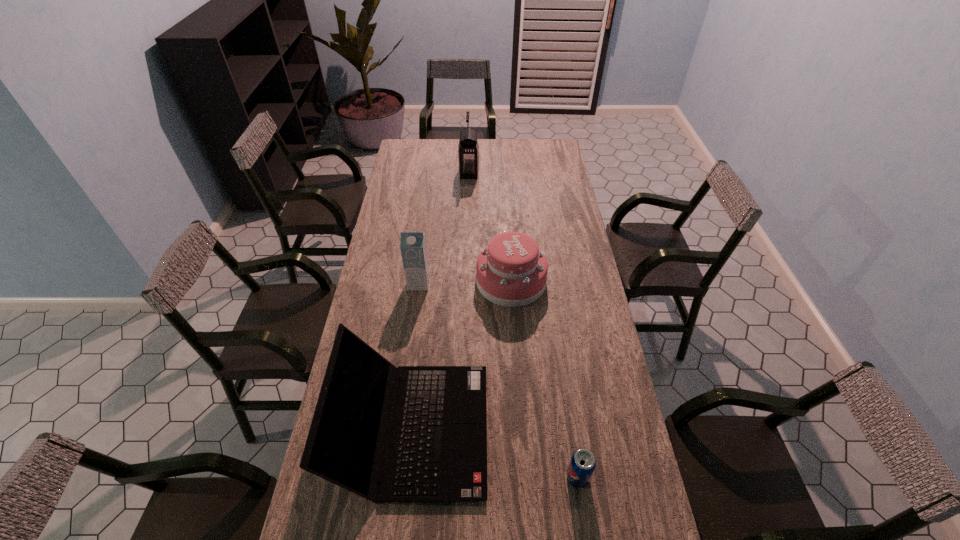
Where is `the tallest object`? The image size is (960, 540). the tallest object is located at coordinates (468, 148).

Image resolution: width=960 pixels, height=540 pixels. I want to click on the farthest object, so [x=468, y=148].

I want to click on carton, so click(413, 248).

Find the location of a particular element. The image size is (960, 540). laptop computer is located at coordinates (438, 453).

Find the location of a particular element. The height and width of the screenshot is (540, 960). cake is located at coordinates (511, 271).

You are a GUI agent. You are given a task and a screenshot of the screen. Output one action in this format:
    pyautogui.click(x=<x>, y=<y>)
    Task: Click on the pop soda
    The height and width of the screenshot is (540, 960).
    Given the screenshot: What is the action you would take?
    (x=582, y=464)

Find the location of a particular element. Image resolution: width=960 pixels, height=540 pixels. vacant space situated 0.380m on the front-facing side of the tallest object is located at coordinates (552, 173).

In order to click on vacant position located on the front label of the carton in this screenshot , I will do `click(415, 314)`.

Locate an element on the screen. The image size is (960, 540). blank area located on the screen of the laptop computer is located at coordinates (553, 429).

Where is `free region located on the back of the cake`? free region located on the back of the cake is located at coordinates (506, 205).